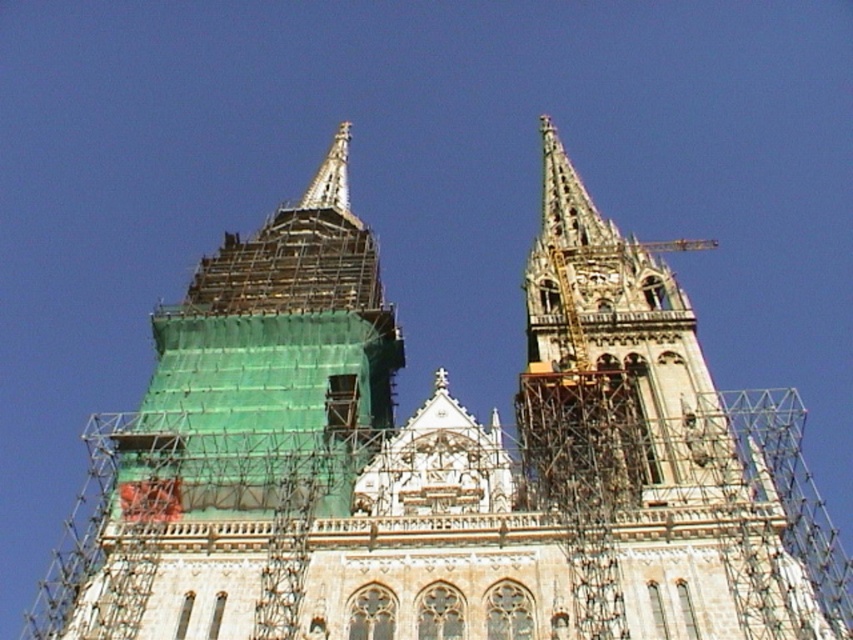
You are an architect examining the cathedral renovation plans. You notice a point marked at coordinates (645, 417). Based on the image, what does this point indicate?

The point at coordinates (645, 417) marks the stone spire at upper center.

You are an architect inspecting the cathedral from the ground. You notice two spires at the upper center of the cathedral. Which one is closer to you, the stone spire at upper center or the silver metallic spire at upper center?

The stone spire at upper center is in front of the silver metallic spire at upper center, so the stone spire at upper center is closer to you.